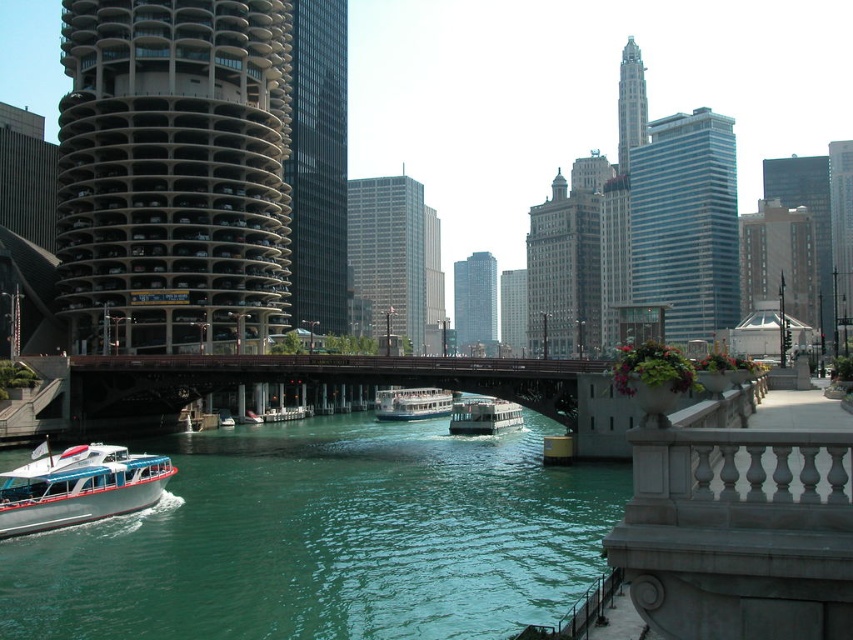
Question: Which object is farther from the camera taking this photo?

Choices:
 (A) white glossy boat at center
 (B) white glossy ferry at center
 (C) white glossy boat at lower left
 (D) green water at lower left

Answer: (A)

Question: Is white glossy boat at lower left to the right of white glossy boat at center from the viewer's perspective?

Choices:
 (A) no
 (B) yes

Answer: (A)

Question: Among these points, which one is farthest from the camera?

Choices:
 (A) (151, 572)
 (B) (430, 396)
 (C) (490, 397)

Answer: (B)

Question: Can you confirm if green water at lower left is wider than white glossy boat at lower left?

Choices:
 (A) yes
 (B) no

Answer: (A)

Question: Which point is closer to the camera?

Choices:
 (A) white glossy ferry at center
 (B) white glossy boat at center

Answer: (A)

Question: In this image, where is white glossy boat at lower left located relative to white glossy boat at center?

Choices:
 (A) right
 (B) left

Answer: (B)